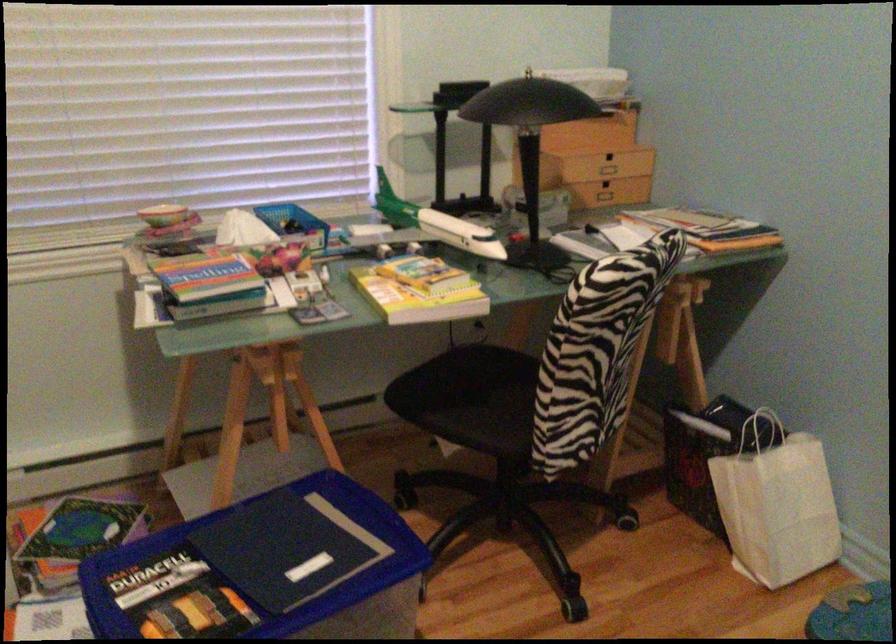
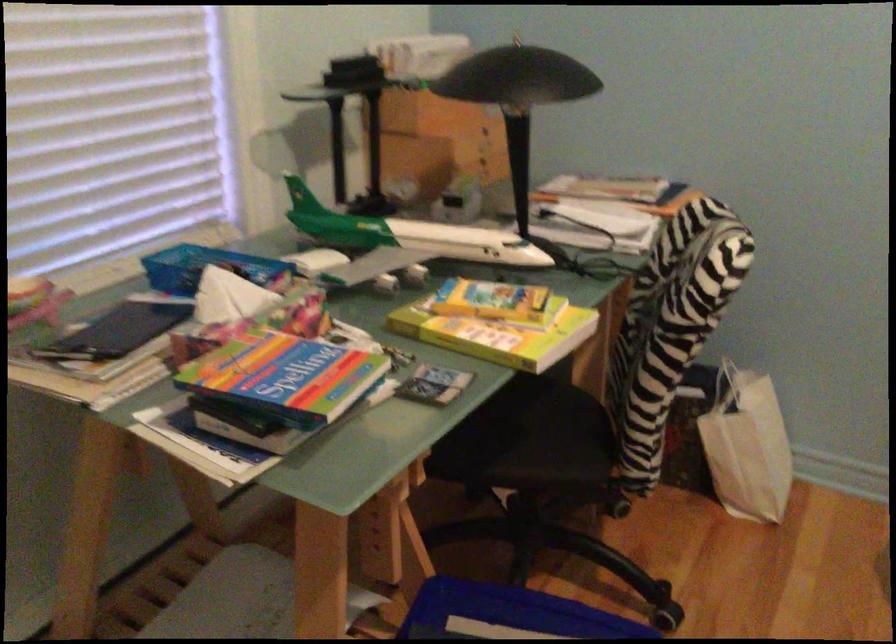
Question: Based on the continuous images, in which direction is the camera rotating? Reply with the corresponding letter.

Choices:
 (A) Left
 (B) Right
 (C) Up
 (D) Down

Answer: (B)